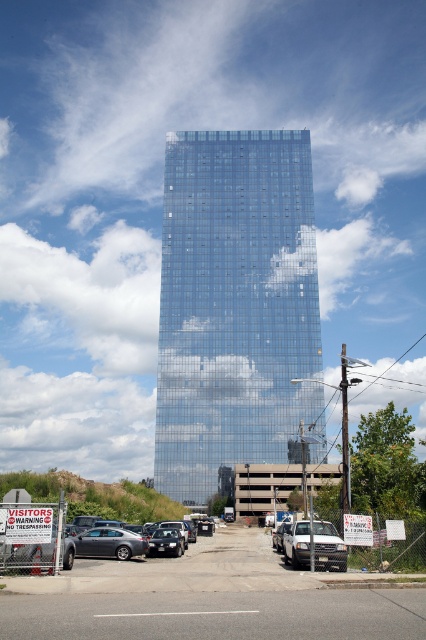
You are a delivery driver approaching the skyscraper and need to park your vehicle. You see a silver metallic truck at center and a satin black sedan at center. Which vehicle is parked higher up in the parking lot?

The silver metallic truck at center is parked higher up in the parking lot than the satin black sedan at center because it is positioned above it.

You are a delivery driver who needs to park your vehicle in the parking lot near the skyscraper. You have a silver metallic truck at center and a satin silver car at lower left. Which vehicle will require more space in the parking spot?

The silver metallic truck at center has a smaller size compared to the satin silver car at lower right, so the satin silver car at lower left will require more space in the parking spot.

You are standing at the point marked by coordinates point (235, 305). Looking around, what structure are you directly facing?

You are directly facing the glossy glass building at center, as the point (235, 305) represents its location.